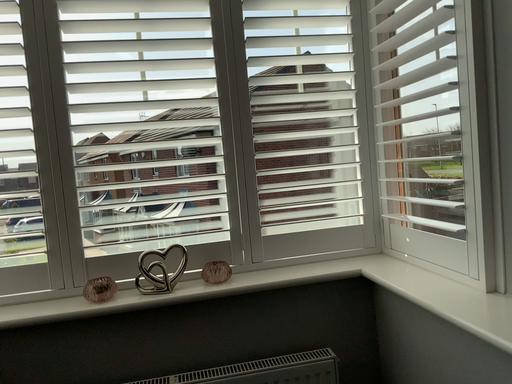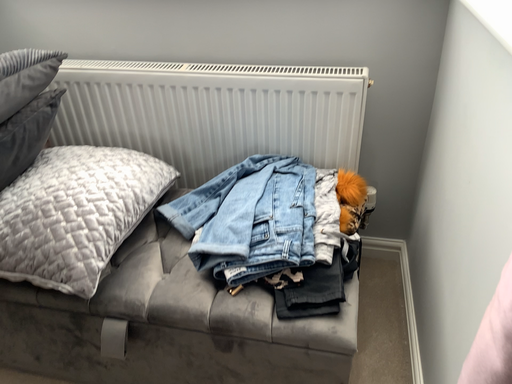
Question: How did the camera likely rotate when shooting the video?

Choices:
 (A) rotated left
 (B) rotated right

Answer: (A)